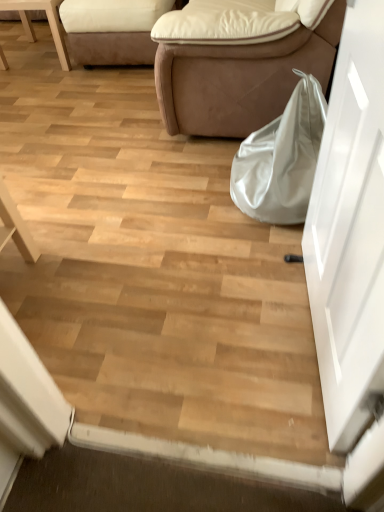
At what (x,y) coordinates should I click in order to perform the action: click on vacant region under white leather chair at upper left (from a real-world perspective). Please return your answer as a coordinate pair (x, y). The width and height of the screenshot is (384, 512). Looking at the image, I should click on (41, 51).